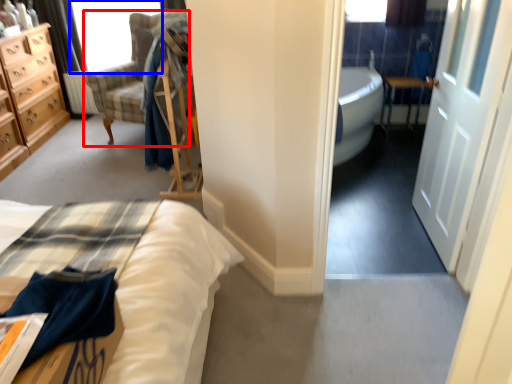
Question: Which object appears farthest to the camera in this image, chair (highlighted by a red box) or window screen (highlighted by a blue box)?

Choices:
 (A) chair
 (B) window screen

Answer: (B)